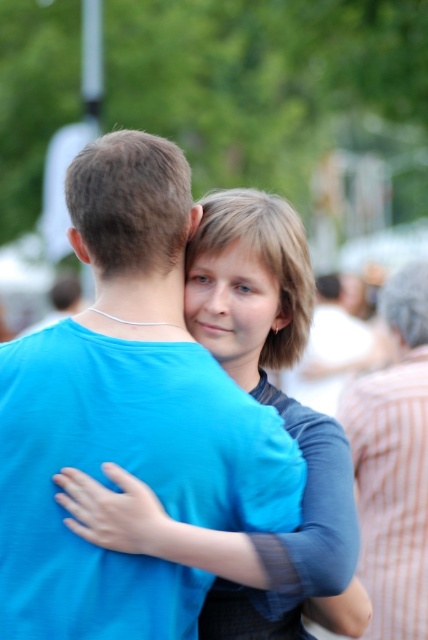
You are a photographer standing 10 feet away from the camera position. You want to take a photo of the blue matte shirt at center. Can you move closer to the shirt without leaving the frame?

The blue matte shirt at center is 7.90 feet from camera. Since you are already 10 feet away from the camera position, you can move 2.1 feet closer to reach the shirt and still be within frame.

Looking at this image, what are the coordinates of the blue matte shirt at center?

The blue matte shirt at center is located at point (127, 416).